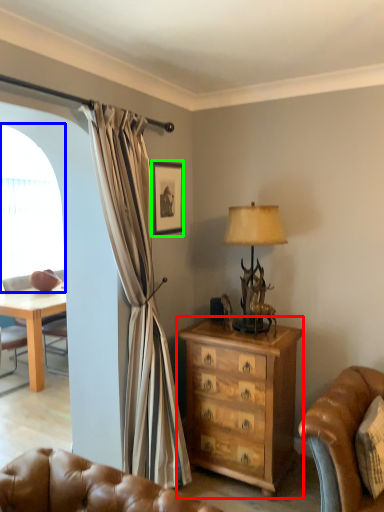
Question: Based on their relative distances, which object is nearer to chest of drawers (highlighted by a red box)? Choose from window screen (highlighted by a blue box) and picture frame (highlighted by a green box).

Choices:
 (A) window screen
 (B) picture frame

Answer: (B)